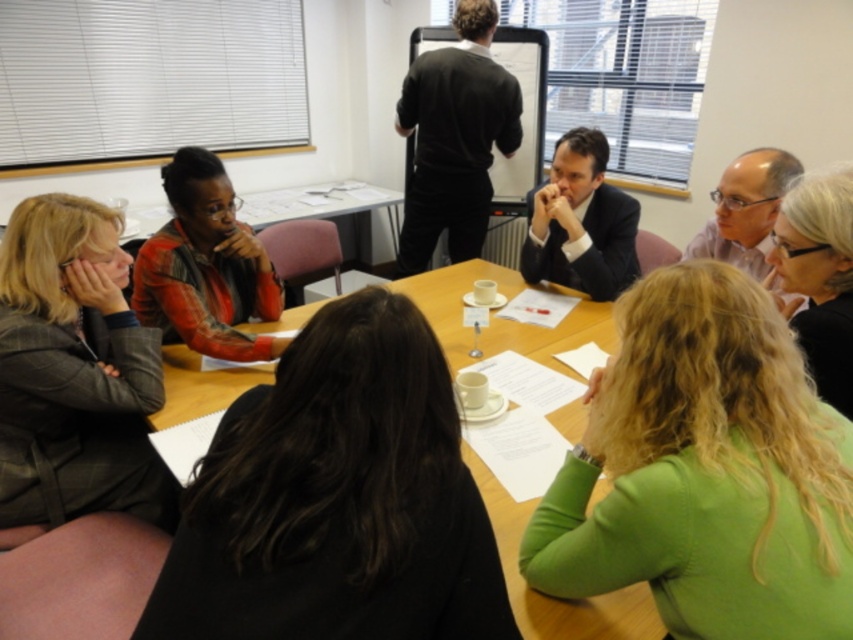
Image resolution: width=853 pixels, height=640 pixels. What do you see at coordinates (337, 499) in the screenshot?
I see `dark brown hair at center` at bounding box center [337, 499].

Which is above, dark brown hair at center or black hair at upper right?

black hair at upper right is higher up.

Is point (386, 467) closer to camera compared to point (850, 195)?

Yes, it is.

Where is `dark brown hair at center`? dark brown hair at center is located at coordinates (337, 499).

Is green fabric shirt at lower right positioned behind plaid wool blazer at left?

No, it is in front of plaid wool blazer at left.

Does green fabric shirt at lower right have a greater height compared to plaid wool blazer at left?

In fact, green fabric shirt at lower right may be shorter than plaid wool blazer at left.

Is point (646, 573) positioned before point (32, 445)?

Yes, it is in front of point (32, 445).

The image size is (853, 640). Identify the location of green fabric shirt at lower right. (705, 470).

Based on the photo, who is more distant from viewer, (x=730, y=547) or (x=844, y=388)?

The point (x=844, y=388) is behind.

Is green fabric shirt at lower right to the left of black hair at upper right from the viewer's perspective?

Indeed, green fabric shirt at lower right is positioned on the left side of black hair at upper right.

Measure the distance between point (x=659, y=412) and camera.

They are 37.27 inches apart.

Where is `green fabric shirt at lower right`? green fabric shirt at lower right is located at coordinates (705, 470).